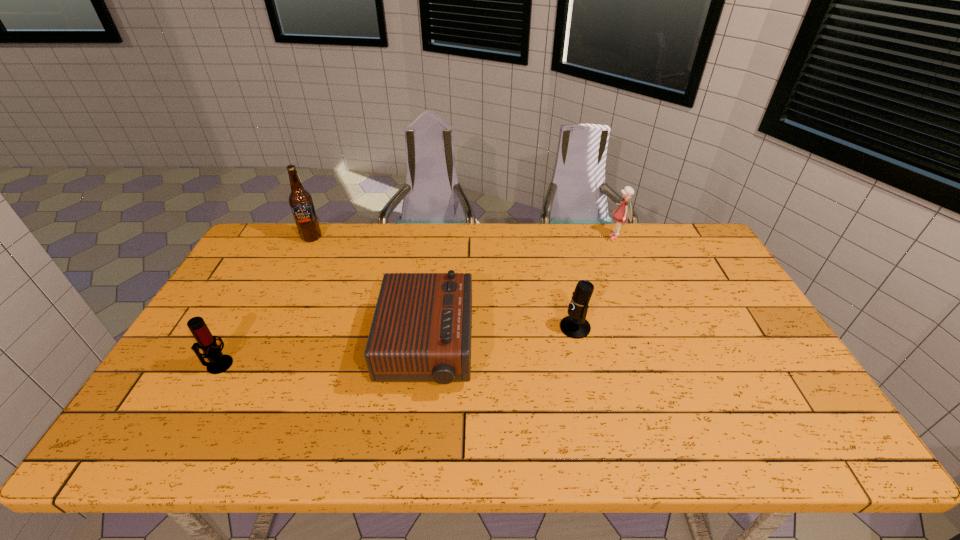
Find the location of a particular element. The image size is (960, 540). object that is at the far left corner is located at coordinates (301, 203).

Where is `free space at the far edge`? free space at the far edge is located at coordinates (532, 236).

Locate an element on the screen. Image resolution: width=960 pixels, height=540 pixels. free spot at the near edge of the desktop is located at coordinates (234, 449).

This screenshot has width=960, height=540. In the image, there is a desktop. In order to click on free space at the left edge in this screenshot , I will do `click(199, 417)`.

Locate an element on the screen. The image size is (960, 540). vacant space at the right edge of the desktop is located at coordinates (742, 298).

Image resolution: width=960 pixels, height=540 pixels. Find the location of `free location at the near left corner`. free location at the near left corner is located at coordinates (204, 422).

In the image, there is a desktop. Identify the location of free space at the far right corner. The width and height of the screenshot is (960, 540). (672, 247).

Identify the location of free point between the fourth shortest object and the farther microphone. This screenshot has height=540, width=960. (595, 282).

Where is `vacant region between the farther microphone and the third object from right to left`? The image size is (960, 540). vacant region between the farther microphone and the third object from right to left is located at coordinates (501, 338).

The image size is (960, 540). In order to click on unoccupied position between the fourth object from right to left and the radio receiver in this screenshot , I will do `click(370, 293)`.